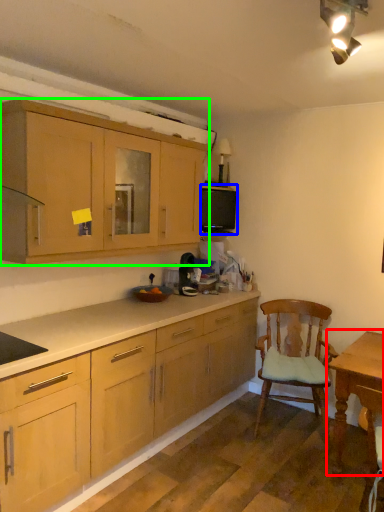
Question: Estimate the real-world distances between objects in this image. Which object is farther from table (highlighted by a red box), appliance (highlighted by a blue box) or cabinetry (highlighted by a green box)?

Choices:
 (A) appliance
 (B) cabinetry

Answer: (B)